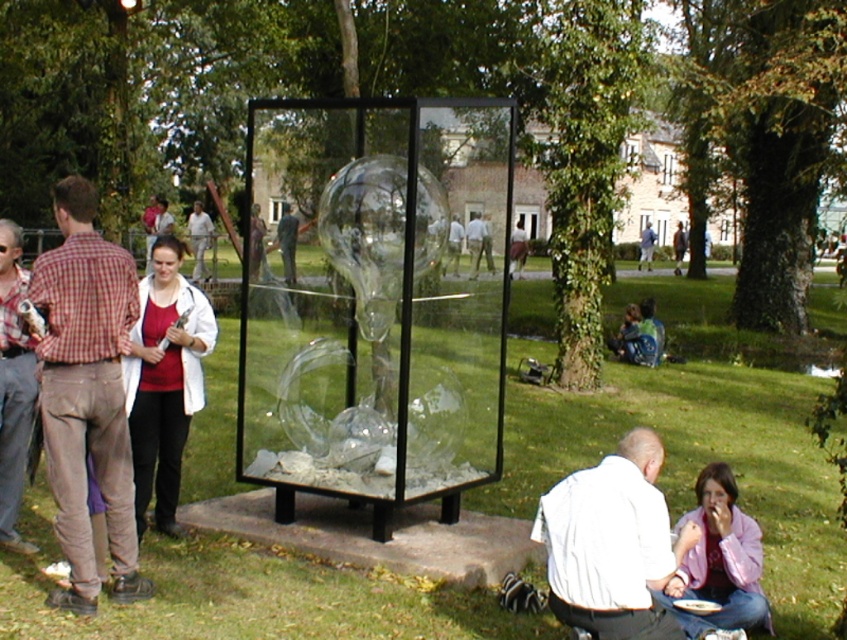
You are standing in the park and want to take a photo of the large transparent glass sculpture. You notice a point at coordinates point (203,636) that is 5.12 meters away from you. If your camera has a maximum focus range of 5 meters, will you be able to focus on the sculpture at that point?

The point at point (203,636) is 5.12 meters away from the viewer. Since the camera can only focus up to 5 meters, the sculpture at that point will be out of focus.

You are standing at the center of the sculpture and want to find the matte brown pants at left. In which direction should you look to see them?

You should look to the left direction to see the matte brown pants at left since they are positioned at point (86,394) which is on the left side of the image.

You are standing at the camera position and want to walk to the green grass at center. How many steps would you need to take if each step is 2.5 feet long?

The green grass at center is 16.65 feet away from the camera. Since each step is 2.5 feet long, you would need approximately 7 steps to reach it.